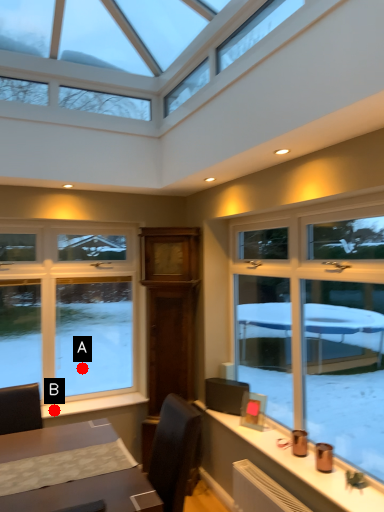
Question: Two points are circled on the image, labeled by A and B beside each circle. Which point appears closest to the camera in this image?

Choices:
 (A) A is closer
 (B) B is closer

Answer: (B)